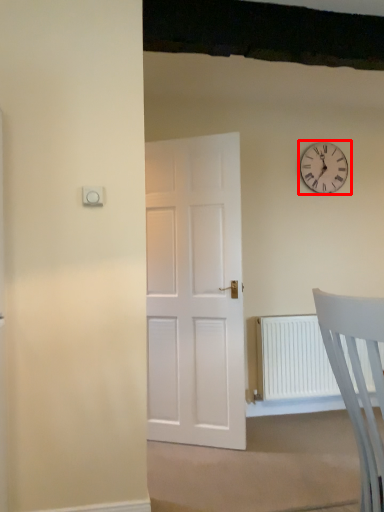
Question: From the image's perspective, considering the relative positions of wall clock (annotated by the red box) and chair in the image provided, where is wall clock (annotated by the red box) located with respect to the staircase?

Choices:
 (A) above
 (B) below

Answer: (A)